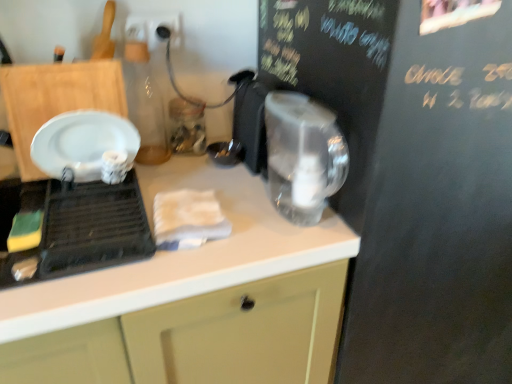
What are the coordinates of `vacant area that is in front of transparent plastic kettle at center` in the screenshot? It's located at click(264, 249).